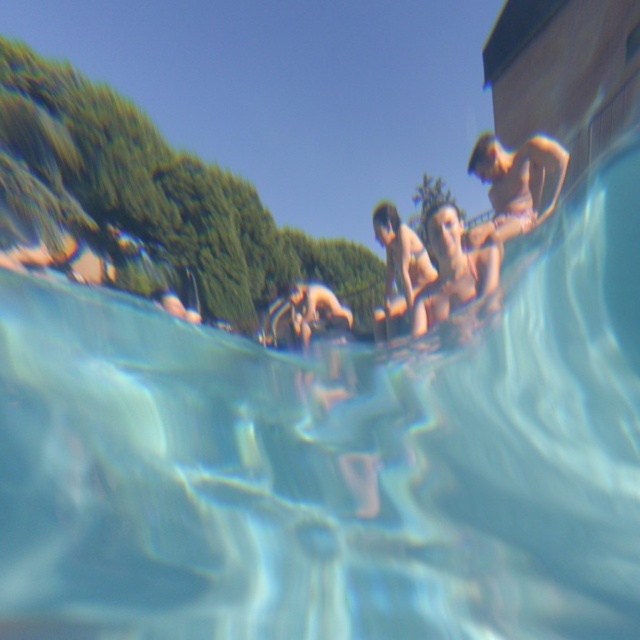
Question: Which of the following is the farthest from the observer?

Choices:
 (A) (468, 170)
 (B) (417, 256)

Answer: (A)

Question: Does tan skin man at upper right appear on the left side of matte bikini swimmer at center?

Choices:
 (A) no
 (B) yes

Answer: (A)

Question: Which object is farther from the camera taking this photo?

Choices:
 (A) tan skin man at upper right
 (B) matte bikini swimmer at center

Answer: (B)

Question: Does tan skin man at upper right have a greater width compared to matte bikini swimmer at center?

Choices:
 (A) no
 (B) yes

Answer: (B)

Question: Which object appears closest to the camera in this image?

Choices:
 (A) tan skin man at upper right
 (B) matte bikini swimmer at center

Answer: (A)

Question: Does tan skin man at upper right appear on the left side of matte bikini swimmer at center?

Choices:
 (A) yes
 (B) no

Answer: (B)